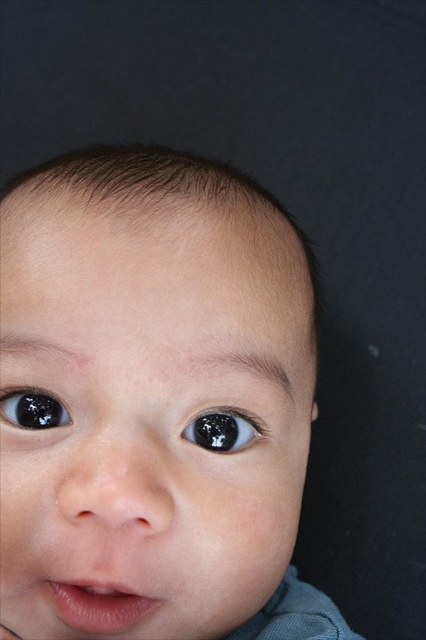
What do you see at coordinates (221, 429) in the screenshot? I see `black glossy eye at center` at bounding box center [221, 429].

You are a GUI agent. You are given a task and a screenshot of the screen. Output one action in this format:
    pyautogui.click(x=<x>, y=<y>)
    Task: Click on the black glossy eye at center
    
    Given the screenshot: What is the action you would take?
    pyautogui.click(x=221, y=429)

This screenshot has height=640, width=426. Find the location of `black glossy eye at center`. black glossy eye at center is located at coordinates (221, 429).

In the scene shown: Is smooth skin baby at center bigger than black glossy eye at left?

Correct, smooth skin baby at center is larger in size than black glossy eye at left.

Does smooth skin baby at center appear over black glossy eye at left?

Actually, smooth skin baby at center is below black glossy eye at left.

At what (x,y) coordinates should I click in order to perform the action: click on smooth skin baby at center. Please return your answer as a coordinate pair (x, y). This screenshot has height=640, width=426. Looking at the image, I should click on (154, 403).

Does point (9, 333) lie behind point (201, 426)?

That is True.

What do you see at coordinates (154, 403) in the screenshot?
I see `smooth skin baby at center` at bounding box center [154, 403].

This screenshot has width=426, height=640. Find the location of `smooth skin baby at center`. smooth skin baby at center is located at coordinates (154, 403).